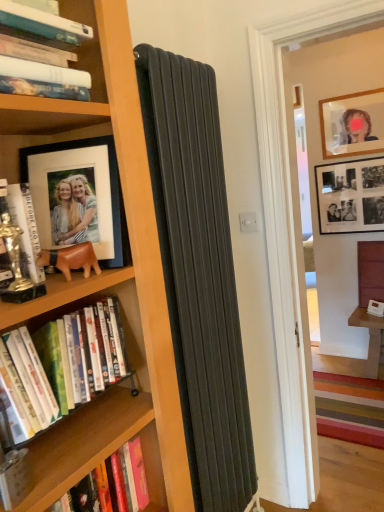
Question: Should I look upward or downward to see matte glass picture frame at upper right, which appears as the second picture frame when viewed from the back?

Choices:
 (A) up
 (B) down

Answer: (A)

Question: From the image's perspective, is leather-like brown bear at left above hardcover book at left, the third book in the bottom-to-top sequence?

Choices:
 (A) no
 (B) yes

Answer: (A)

Question: Is leather-like brown bear at left placed right next to hardcover book at left, which appears as the 2th book when viewed from the top?

Choices:
 (A) no
 (B) yes

Answer: (B)

Question: Is leather-like brown bear at left thinner than hardcover book at left, which appears as the 2th book when viewed from the top?

Choices:
 (A) no
 (B) yes

Answer: (B)

Question: Is leather-like brown bear at left outside hardcover book at left, which appears as the 2th book when viewed from the top?

Choices:
 (A) yes
 (B) no

Answer: (A)

Question: From a real-world perspective, is leather-like brown bear at left physically below hardcover book at left, which appears as the 2th book when viewed from the top?

Choices:
 (A) yes
 (B) no

Answer: (A)

Question: Is there a large distance between leather-like brown bear at left and hardcover book at left, which appears as the 2th book when viewed from the top?

Choices:
 (A) no
 (B) yes

Answer: (A)

Question: Can you confirm if hardcover books at left, placed as the 3th book when sorted from top to bottom, is smaller than black matte photo frame at upper right, the second picture frame viewed from the top?

Choices:
 (A) yes
 (B) no

Answer: (B)

Question: From the image's perspective, is hardcover books at left, placed as the 3th book when sorted from top to bottom, above black matte photo frame at upper right, which is the third picture frame from front to back?

Choices:
 (A) yes
 (B) no

Answer: (B)

Question: Can you confirm if hardcover books at left, placed as the 3th book when sorted from top to bottom, is shorter than black matte photo frame at upper right, which is the 3th picture frame in left-to-right order?

Choices:
 (A) yes
 (B) no

Answer: (A)

Question: Is hardcover books at left, the second book from the bottom, wider than black matte photo frame at upper right, which is the 3th picture frame in left-to-right order?

Choices:
 (A) yes
 (B) no

Answer: (A)

Question: From a real-world perspective, is hardcover books at left, the second book from the bottom, located beneath black matte photo frame at upper right, the second picture frame viewed from the top?

Choices:
 (A) no
 (B) yes

Answer: (B)

Question: From the image's perspective, does hardcover books at left, placed as the 3th book when sorted from top to bottom, appear lower than black matte photo frame at upper right, which is the third picture frame from front to back?

Choices:
 (A) yes
 (B) no

Answer: (A)

Question: Can we say black matte photo frame at upper right, the first picture frame viewed from the right, lies outside hardcover books at left, the second book from the bottom?

Choices:
 (A) no
 (B) yes

Answer: (B)